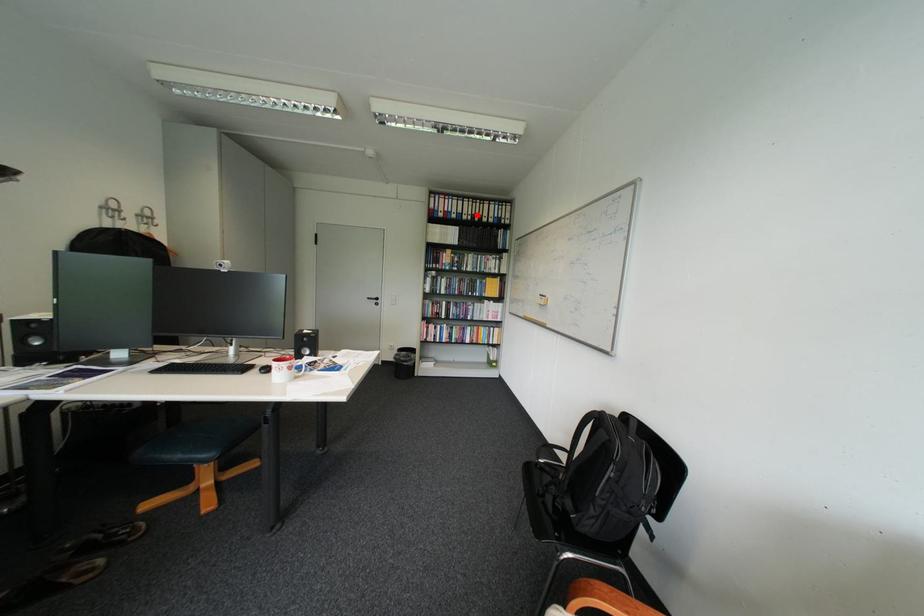
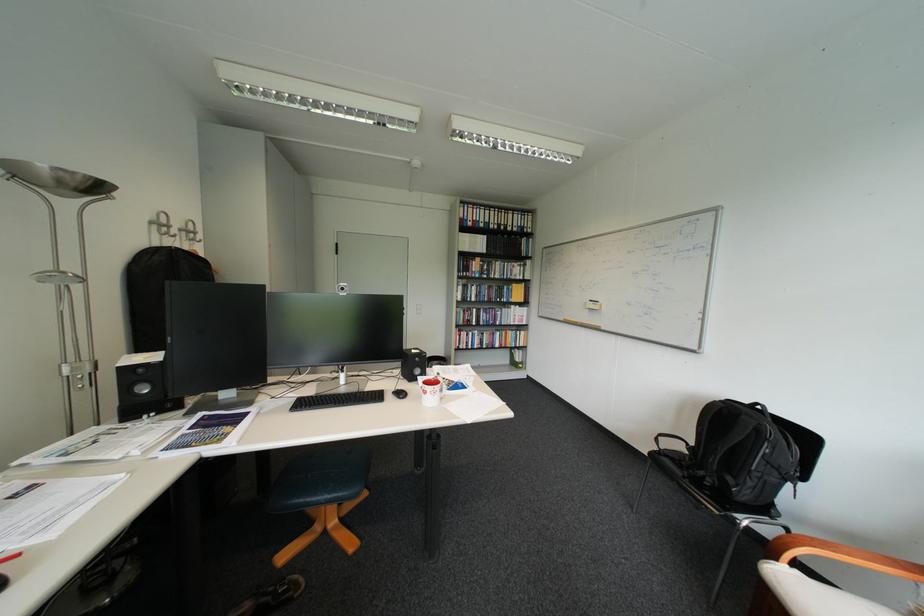
Find the pixel in the second image that matches the highlighted location in the first image.

(504, 224)